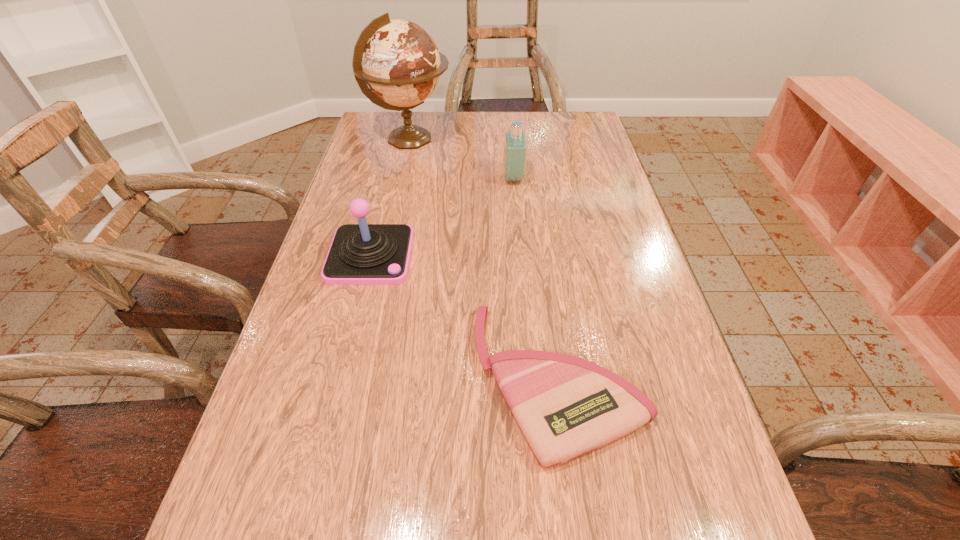
Identify the location of globe. The image size is (960, 540). (399, 61).

At what (x,y) coordinates should I click in order to perform the action: click on the farthest object. Please return your answer as a coordinate pair (x, y). The image size is (960, 540). Looking at the image, I should click on (399, 61).

Find the location of a particular element. the third nearest object is located at coordinates (515, 144).

Image resolution: width=960 pixels, height=540 pixels. I want to click on the second nearest object, so click(360, 254).

This screenshot has height=540, width=960. In order to click on the shortest object in this screenshot , I will do `click(565, 406)`.

Locate an element on the screen. This screenshot has height=540, width=960. the nearest object is located at coordinates (565, 406).

Where is `vacant area located on the front of the globe showing Asia`? vacant area located on the front of the globe showing Asia is located at coordinates (468, 139).

Image resolution: width=960 pixels, height=540 pixels. I want to click on vacant space situated on the front label of the second farthest object, so click(x=383, y=178).

Where is `vacant region located 0.070m on the front label of the second farthest object`? vacant region located 0.070m on the front label of the second farthest object is located at coordinates click(x=478, y=178).

Find the location of `vacant region located on the front label of the second farthest object`. vacant region located on the front label of the second farthest object is located at coordinates (425, 178).